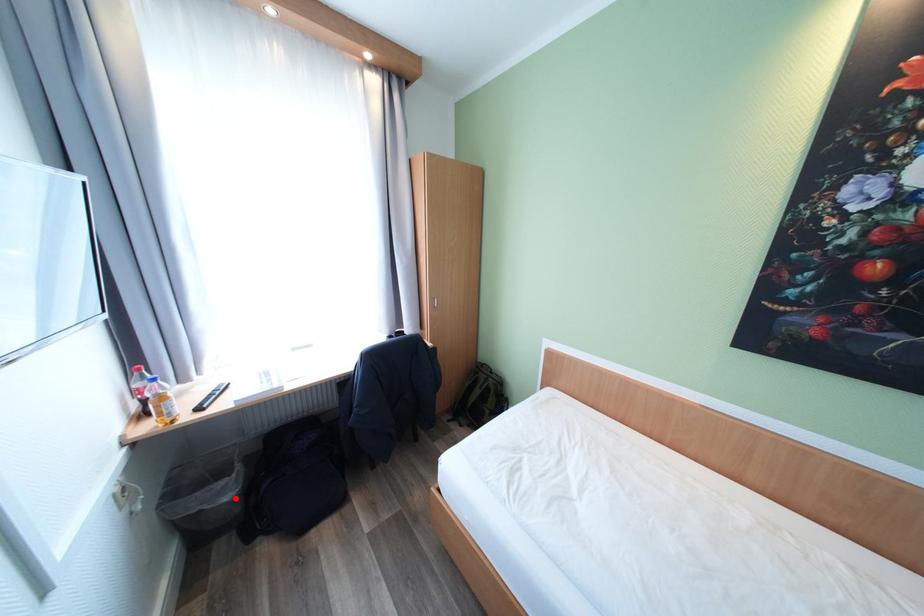
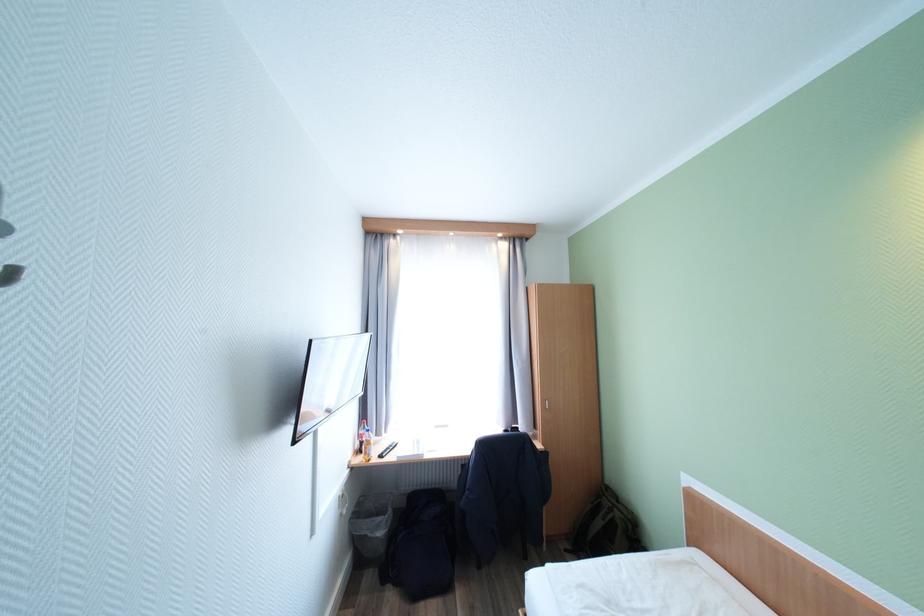
Question: I am providing you with two images of the same scene from different viewpoints. A red point is shown in image1. For the corresponding object point in image2, is it positioned nearer or farther from the camera?

Choices:
 (A) Nearer
 (B) Farther

Answer: (A)